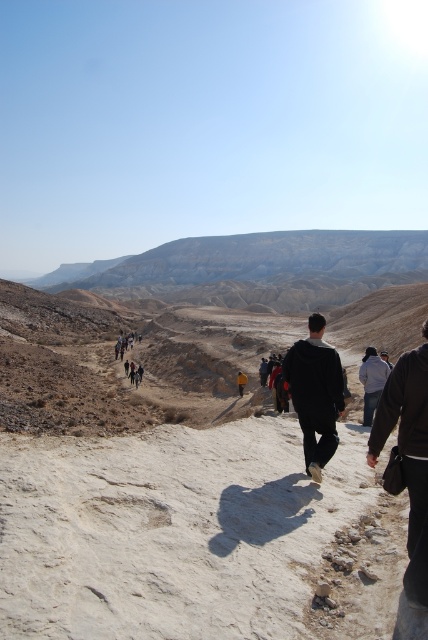
Question: Does desert sandstone mountain at upper center appear on the right side of black matte jacket at center?

Choices:
 (A) yes
 (B) no

Answer: (B)

Question: Among these objects, which one is farthest from the camera?

Choices:
 (A) desert sandstone mountain at upper center
 (B) dusty sand desert at center

Answer: (A)

Question: Can you confirm if desert sandstone mountain at upper center is bigger than black matte jacket at center?

Choices:
 (A) no
 (B) yes

Answer: (B)

Question: Which object is the farthest from the black matte jacket at center?

Choices:
 (A) dusty sand desert at center
 (B) desert sandstone mountain at upper center

Answer: (B)

Question: Among these objects, which one is nearest to the camera?

Choices:
 (A) black matte jacket at center
 (B) desert sandstone mountain at upper center
 (C) dusty sand desert at center

Answer: (C)

Question: Is desert sandstone mountain at upper center to the left of black matte jacket at center from the viewer's perspective?

Choices:
 (A) yes
 (B) no

Answer: (A)